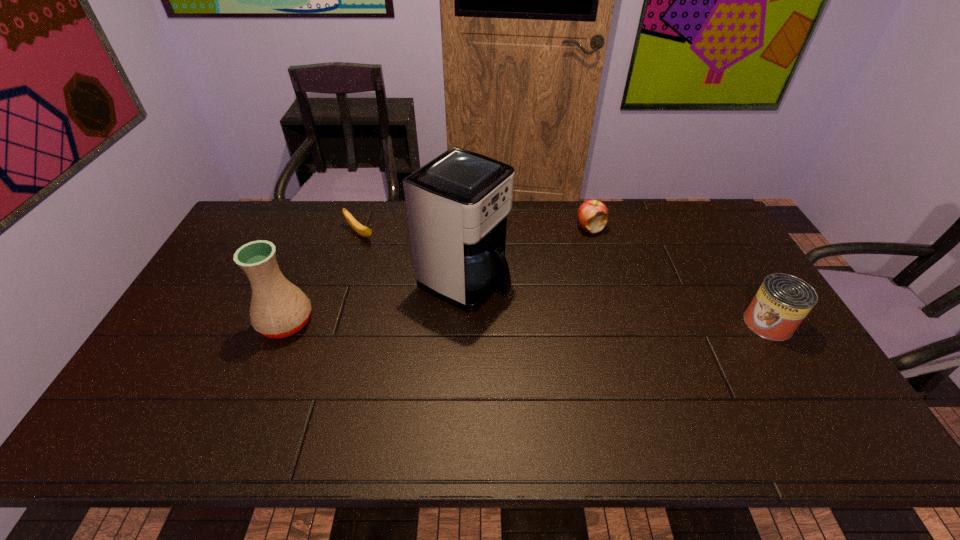
This screenshot has width=960, height=540. I want to click on pottery, so click(278, 309).

Find the location of a particular element. This screenshot has height=540, width=960. the rightmost object is located at coordinates (782, 302).

The width and height of the screenshot is (960, 540). Find the location of `the third tallest object`. the third tallest object is located at coordinates (782, 302).

The height and width of the screenshot is (540, 960). I want to click on the fourth tallest object, so click(x=592, y=215).

In order to click on apple in this screenshot , I will do `click(592, 215)`.

Locate an element on the screen. The image size is (960, 540). the shortest object is located at coordinates (363, 231).

You are a GUI agent. You are given a task and a screenshot of the screen. Output one action in this format:
    pyautogui.click(x=<x>, y=<y>)
    Task: Click on the tallest object
    
    Given the screenshot: What is the action you would take?
    pyautogui.click(x=457, y=204)

Locate an element on the screen. Image resolution: width=960 pixels, height=540 pixels. the third object from left to right is located at coordinates (457, 204).

Find the location of a particular element. free location located 0.380m on the back of the pottery is located at coordinates (327, 223).

The height and width of the screenshot is (540, 960). Identify the location of vacant space located on the front of the third shortest object. (813, 398).